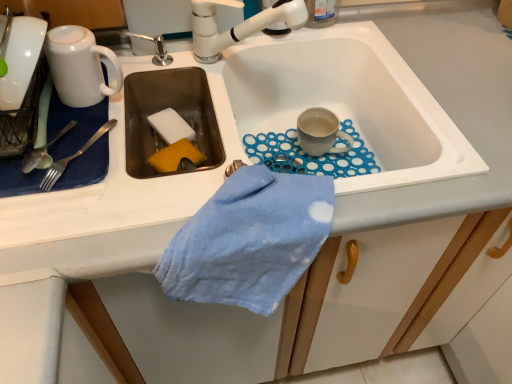
Question: Can you confirm if white ceramic tap at upper center is smaller than white sponge at sink left?

Choices:
 (A) no
 (B) yes

Answer: (A)

Question: Are white ceramic tap at upper center and white sponge at sink left beside each other?

Choices:
 (A) no
 (B) yes

Answer: (A)

Question: Is white ceramic tap at upper center positioned far away from white sponge at sink left?

Choices:
 (A) yes
 (B) no

Answer: (B)

Question: From a real-world perspective, is white ceramic tap at upper center positioned under white sponge at sink left based on gravity?

Choices:
 (A) yes
 (B) no

Answer: (B)

Question: From the image's perspective, would you say white ceramic tap at upper center is positioned over white sponge at sink left?

Choices:
 (A) yes
 (B) no

Answer: (A)

Question: From their relative heights in the image, would you say white ceramic sink at center is taller or shorter than white sponge at sink left?

Choices:
 (A) tall
 (B) short

Answer: (A)

Question: From a real-world perspective, is white ceramic sink at center positioned above or below white sponge at sink left?

Choices:
 (A) above
 (B) below

Answer: (A)

Question: From the image's perspective, is white ceramic sink at center above or below white sponge at sink left?

Choices:
 (A) below
 (B) above

Answer: (A)

Question: Based on their positions, is white ceramic sink at center located to the left or right of white sponge at sink left?

Choices:
 (A) left
 (B) right

Answer: (B)

Question: Is satin silver fork at left, the first silverware from the right, wider or thinner than white glossy mug at upper left, which is counted as the 2th coffee cup, starting from the right?

Choices:
 (A) wide
 (B) thin

Answer: (A)

Question: Is satin silver fork at left, the first silverware from the right, bigger or smaller than white glossy mug at upper left, the first coffee cup viewed from the left?

Choices:
 (A) big
 (B) small

Answer: (B)

Question: From a real-world perspective, is satin silver fork at left, which is the third silverware from left to right, positioned above or below white glossy mug at upper left, the first coffee cup viewed from the left?

Choices:
 (A) above
 (B) below

Answer: (B)

Question: Is satin silver fork at left, which is the third silverware from left to right, inside the boundaries of white glossy mug at upper left, acting as the first coffee cup starting from the front, or outside?

Choices:
 (A) inside
 (B) outside

Answer: (B)

Question: Would you say satin silver fork at left, the first silverware from the right, is inside or outside white ceramic tap at upper center?

Choices:
 (A) inside
 (B) outside

Answer: (B)

Question: From a real-world perspective, is satin silver fork at left, the first silverware from the right, above or below white ceramic tap at upper center?

Choices:
 (A) above
 (B) below

Answer: (B)